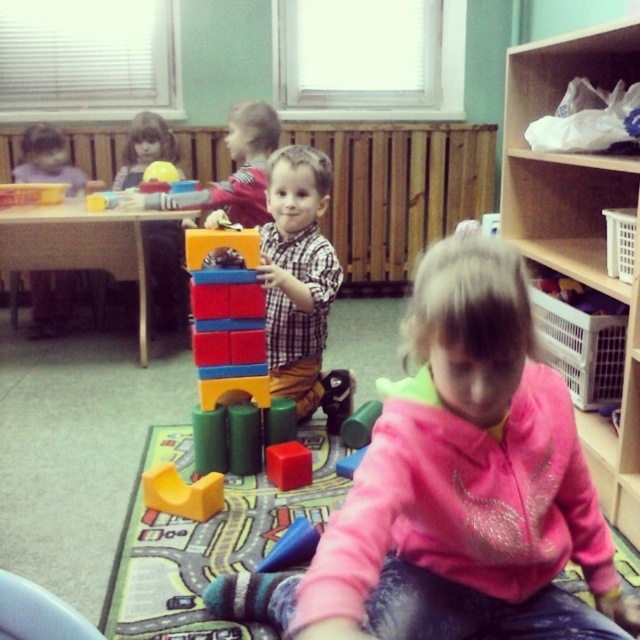
Question: Is smooth plastic head at upper left thinner than rubberized blue car at center?

Choices:
 (A) yes
 (B) no

Answer: (B)

Question: Can you confirm if wooden bookshelf at upper right is smaller than yellow matte block at center?

Choices:
 (A) no
 (B) yes

Answer: (A)

Question: Which object is positioned farthest from the rubber block at center?

Choices:
 (A) rubberized blue car at center
 (B) yellow matte block at center
 (C) multicolored plastic blocks at center
 (D) smooth plastic head at upper left

Answer: (D)

Question: Can you confirm if yellow matte block at center is positioned below smooth plastic head at upper left?

Choices:
 (A) no
 (B) yes

Answer: (B)

Question: Estimate the real-world distances between objects in this image. Which object is closer to the rubberized blue car at center?

Choices:
 (A) checkered fabric shirt at center
 (B) wooden bookshelf at upper right

Answer: (A)

Question: Which point is closer to the camera?

Choices:
 (A) rubber block at center
 (B) checkered fabric shirt at center
 (C) smooth plastic head at upper left
 (D) wooden bookshelf at upper right

Answer: (D)